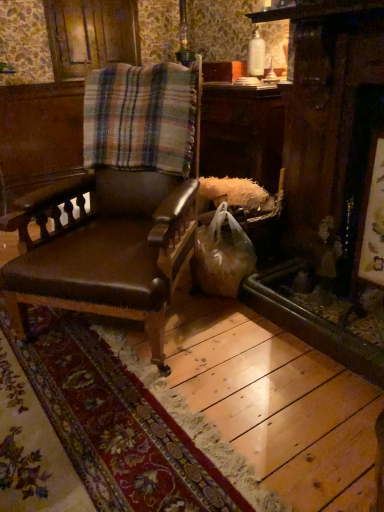
Question: Considering the relative positions of plaid fabric at center and translucent plastic bag at lower right in the image provided, is plaid fabric at center to the left of translucent plastic bag at lower right from the viewer's perspective?

Choices:
 (A) yes
 (B) no

Answer: (A)

Question: From a real-world perspective, is plaid fabric at center on top of translucent plastic bag at lower right?

Choices:
 (A) no
 (B) yes

Answer: (B)

Question: Can you confirm if plaid fabric at center is smaller than translucent plastic bag at lower right?

Choices:
 (A) yes
 (B) no

Answer: (B)

Question: Considering the relative sizes of plaid fabric at center and translucent plastic bag at lower right in the image provided, is plaid fabric at center bigger than translucent plastic bag at lower right?

Choices:
 (A) no
 (B) yes

Answer: (B)

Question: Is plaid fabric at center thinner than translucent plastic bag at lower right?

Choices:
 (A) yes
 (B) no

Answer: (A)

Question: Considering the positions of matte brown leather chair at center and translucent plastic bag at lower right in the image, is matte brown leather chair at center wider or thinner than translucent plastic bag at lower right?

Choices:
 (A) wide
 (B) thin

Answer: (A)

Question: Considering the relative positions of matte brown leather chair at center and translucent plastic bag at lower right in the image provided, is matte brown leather chair at center to the left or to the right of translucent plastic bag at lower right?

Choices:
 (A) left
 (B) right

Answer: (A)

Question: Choose the correct answer: Is matte brown leather chair at center inside translucent plastic bag at lower right or outside it?

Choices:
 (A) inside
 (B) outside

Answer: (B)

Question: Is matte brown leather chair at center in front of or behind translucent plastic bag at lower right in the image?

Choices:
 (A) front
 (B) behind

Answer: (A)

Question: Considering the positions of plaid fabric at center and matte brown leather chair at center in the image, is plaid fabric at center bigger or smaller than matte brown leather chair at center?

Choices:
 (A) small
 (B) big

Answer: (A)

Question: Which is correct: plaid fabric at center is inside matte brown leather chair at center, or outside of it?

Choices:
 (A) inside
 (B) outside

Answer: (A)

Question: From the image's perspective, is plaid fabric at center above or below matte brown leather chair at center?

Choices:
 (A) below
 (B) above

Answer: (B)

Question: Considering their positions, is plaid fabric at center located in front of or behind matte brown leather chair at center?

Choices:
 (A) behind
 (B) front

Answer: (A)

Question: Which is correct: translucent plastic bag at lower right is inside matte brown leather chair at center, or outside of it?

Choices:
 (A) outside
 (B) inside

Answer: (A)

Question: Is point (195, 250) closer or farther from the camera than point (119, 189)?

Choices:
 (A) farther
 (B) closer

Answer: (A)